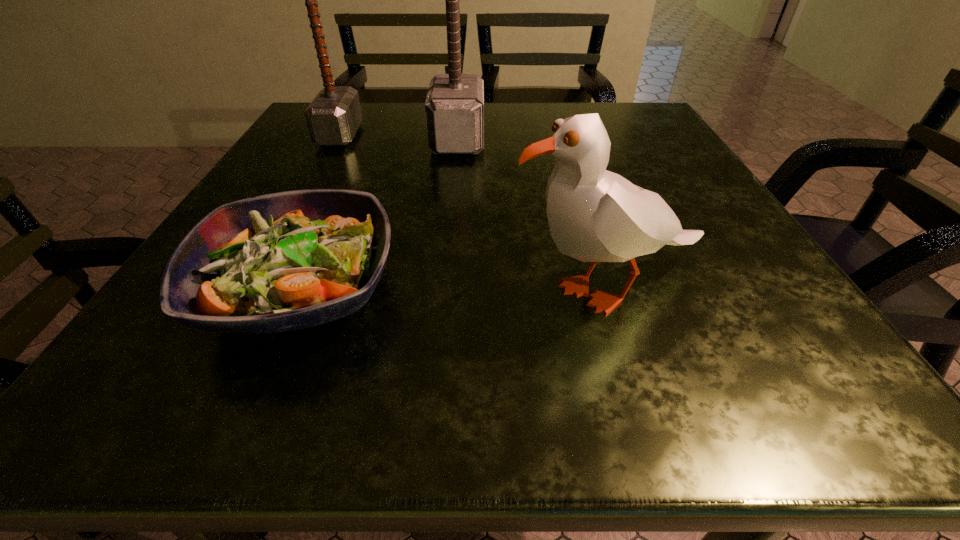
At what (x,y) coordinates should I click in order to perform the action: click on vacant region at the far right corner of the desktop. Please return your answer as a coordinate pair (x, y). Looking at the image, I should click on (603, 117).

Where is `unoccupied area between the second shortest object and the left hammer`? The image size is (960, 540). unoccupied area between the second shortest object and the left hammer is located at coordinates (474, 213).

At what (x,y) coordinates should I click in order to perform the action: click on free spot between the left hammer and the third tallest object. Please return your answer as a coordinate pair (x, y). This screenshot has width=960, height=540. Looking at the image, I should click on (474, 213).

This screenshot has width=960, height=540. What are the coordinates of `unoccupied area between the left hammer and the gull` in the screenshot? It's located at (474, 213).

This screenshot has height=540, width=960. In order to click on free spot between the rightmost object and the second object from right to left in this screenshot , I will do (534, 215).

Where is `free space between the left hammer and the second object from right to left`? The image size is (960, 540). free space between the left hammer and the second object from right to left is located at coordinates (398, 138).

You are a GUI agent. You are given a task and a screenshot of the screen. Output one action in this format:
    pyautogui.click(x=<x>, y=<y>)
    Task: Click on the vacant space that's between the rightmost object and the left hammer
    
    Given the screenshot: What is the action you would take?
    pyautogui.click(x=474, y=213)

This screenshot has width=960, height=540. In order to click on empty space between the third object from left to right and the left hammer in this screenshot , I will do `click(398, 138)`.

Where is `free space between the left hammer and the rightmost object`? free space between the left hammer and the rightmost object is located at coordinates (474, 213).

Locate an element on the screen. The image size is (960, 540). object that ranks as the closest to the shortest object is located at coordinates (594, 215).